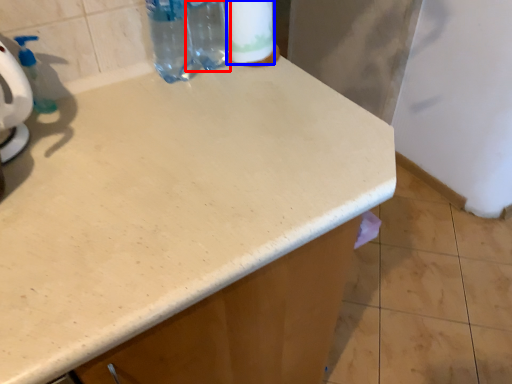
Question: Among these objects, which one is farthest to the camera, bottle (highlighted by a red box) or toilet paper (highlighted by a blue box)?

Choices:
 (A) bottle
 (B) toilet paper

Answer: (A)